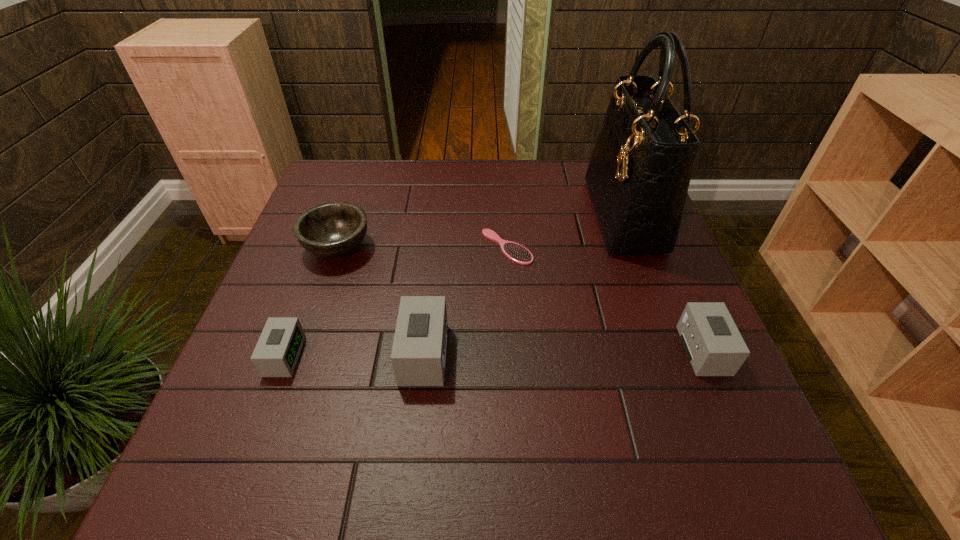
If equal spacing is the goal by inserting an additional alarm_clock among them, please point out a vacant space for this new alarm_clock. Please provide its 2D coordinates. Your answer should be formatted as a tuple, i.e. [(x, y)], where the tuple contains the x and y coordinates of a point satisfying the conditions above.

[(564, 352)]